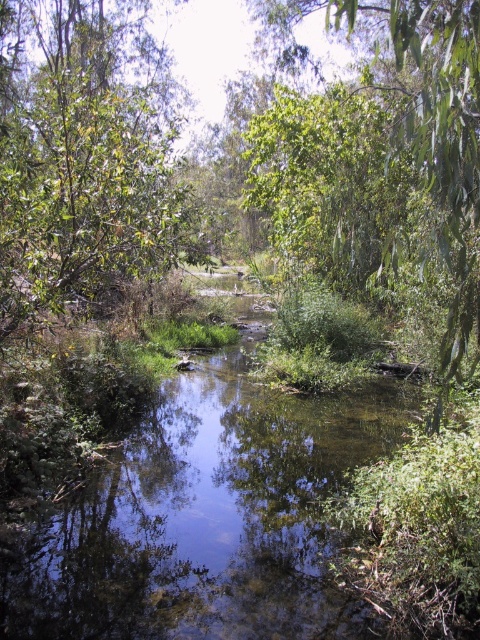
Question: Which of the following is the farthest from the observer?

Choices:
 (A) (147, 182)
 (B) (253, 566)

Answer: (A)

Question: Is clear water at center wider than green leafy tree at upper left?

Choices:
 (A) yes
 (B) no

Answer: (B)

Question: Is clear water at center behind green leafy tree at upper left?

Choices:
 (A) no
 (B) yes

Answer: (A)

Question: Is clear water at center below green leafy tree at upper left?

Choices:
 (A) yes
 (B) no

Answer: (A)

Question: Which point is closer to the camera?

Choices:
 (A) clear water at center
 (B) green leafy tree at upper left

Answer: (A)